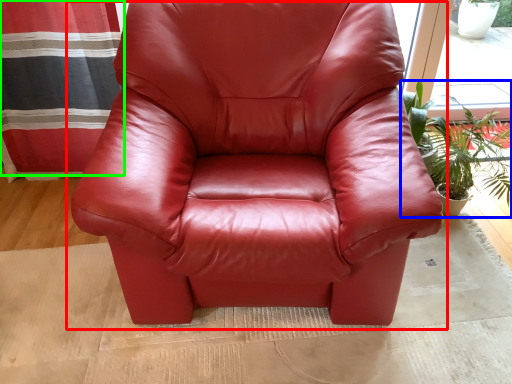
Question: Which object is the closest to the chair (highlighted by a red box)? Choose among these: houseplant (highlighted by a blue box) or curtain (highlighted by a green box).

Choices:
 (A) houseplant
 (B) curtain

Answer: (A)